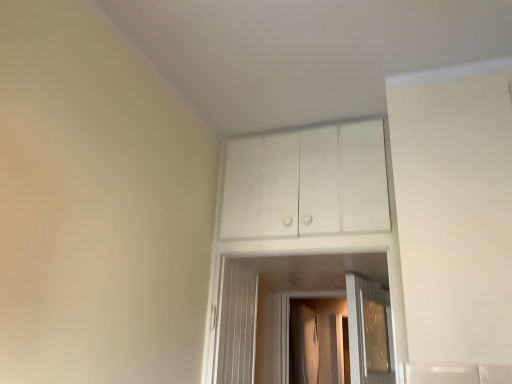
Question: Is transparent plastic screen door at center smaller than white matte cabinet at upper center?

Choices:
 (A) yes
 (B) no

Answer: (B)

Question: Does transparent plastic screen door at center come in front of white matte cabinet at upper center?

Choices:
 (A) yes
 (B) no

Answer: (B)

Question: Are transparent plastic screen door at center and white matte cabinet at upper center located far from each other?

Choices:
 (A) no
 (B) yes

Answer: (B)

Question: Is transparent plastic screen door at center positioned with its back to white matte cabinet at upper center?

Choices:
 (A) no
 (B) yes

Answer: (A)

Question: From the image's perspective, is transparent plastic screen door at center over white matte cabinet at upper center?

Choices:
 (A) yes
 (B) no

Answer: (B)

Question: Is transparent plastic screen door at center located outside white matte cabinet at upper center?

Choices:
 (A) yes
 (B) no

Answer: (A)

Question: Is white matte cabinet at upper center positioned in front of transparent plastic screen door at center?

Choices:
 (A) no
 (B) yes

Answer: (B)

Question: Would you say transparent plastic screen door at center is part of white matte cabinet at upper center's contents?

Choices:
 (A) yes
 (B) no

Answer: (B)

Question: Considering the relative sizes of white matte cabinet at upper center and transparent plastic screen door at center in the image provided, is white matte cabinet at upper center wider than transparent plastic screen door at center?

Choices:
 (A) yes
 (B) no

Answer: (B)

Question: From a real-world perspective, is white matte cabinet at upper center on transparent plastic screen door at center?

Choices:
 (A) no
 (B) yes

Answer: (B)

Question: Does white matte cabinet at upper center appear on the left side of transparent plastic screen door at center?

Choices:
 (A) no
 (B) yes

Answer: (B)

Question: Is white matte cabinet at upper center oriented away from transparent plastic screen door at center?

Choices:
 (A) yes
 (B) no

Answer: (A)

Question: From the image's perspective, is transparent plastic screen door at center located above or below white matte cabinet at upper center?

Choices:
 (A) below
 (B) above

Answer: (A)